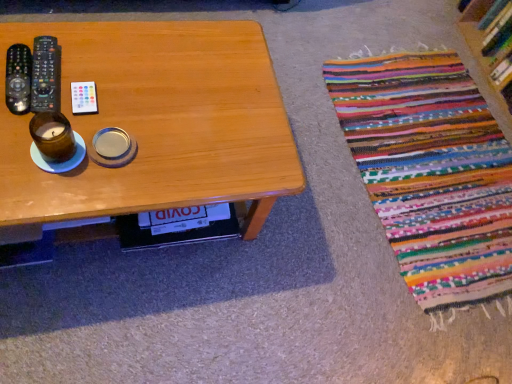
Question: From a real-world perspective, does wooden bookshelf at upper right stand above black plastic remote control at left, which appears as the 1th remote control when viewed from the left?

Choices:
 (A) no
 (B) yes

Answer: (A)

Question: Is wooden bookshelf at upper right next to black plastic remote control at left, positioned as the 3th remote control in right-to-left order?

Choices:
 (A) yes
 (B) no

Answer: (B)

Question: Is black plastic remote control at left, positioned as the 3th remote control in right-to-left order, surrounded by wooden bookshelf at upper right?

Choices:
 (A) yes
 (B) no

Answer: (B)

Question: Does wooden bookshelf at upper right appear on the right side of black plastic remote control at left, which appears as the 1th remote control when viewed from the left?

Choices:
 (A) no
 (B) yes

Answer: (B)

Question: Is the position of wooden bookshelf at upper right less distant than that of black plastic remote control at left, positioned as the 3th remote control in right-to-left order?

Choices:
 (A) no
 (B) yes

Answer: (A)

Question: Considering the relative positions of wooden table at center and white plastic remote control at upper left, the third remote control when ordered from left to right, in the image provided, is wooden table at center to the left or to the right of white plastic remote control at upper left, the third remote control when ordered from left to right,?

Choices:
 (A) right
 (B) left

Answer: (A)

Question: Is wooden table at center taller or shorter than white plastic remote control at upper left, the third remote control when ordered from left to right?

Choices:
 (A) short
 (B) tall

Answer: (B)

Question: In the image, is wooden table at center positioned in front of or behind white plastic remote control at upper left, which is counted as the 1th remote control, starting from the right?

Choices:
 (A) behind
 (B) front

Answer: (B)

Question: From a real-world perspective, relative to white plastic remote control at upper left, the third remote control when ordered from left to right, is wooden table at center vertically above or below?

Choices:
 (A) above
 (B) below

Answer: (B)

Question: Considering the positions of brown glass candle at left and multicolored woven rug at lower right in the image, is brown glass candle at left wider or thinner than multicolored woven rug at lower right?

Choices:
 (A) wide
 (B) thin

Answer: (B)

Question: From the image's perspective, is brown glass candle at left above or below multicolored woven rug at lower right?

Choices:
 (A) above
 (B) below

Answer: (B)

Question: Is brown glass candle at left taller or shorter than multicolored woven rug at lower right?

Choices:
 (A) tall
 (B) short

Answer: (A)

Question: Relative to multicolored woven rug at lower right, is brown glass candle at left in front or behind?

Choices:
 (A) behind
 (B) front

Answer: (B)

Question: Is wooden bookshelf at upper right bigger or smaller than white plastic remote control at upper left, which is counted as the 1th remote control, starting from the right?

Choices:
 (A) big
 (B) small

Answer: (A)

Question: Considering the positions of wooden bookshelf at upper right and white plastic remote control at upper left, which is counted as the 1th remote control, starting from the right, in the image, is wooden bookshelf at upper right taller or shorter than white plastic remote control at upper left, which is counted as the 1th remote control, starting from the right,?

Choices:
 (A) short
 (B) tall

Answer: (B)